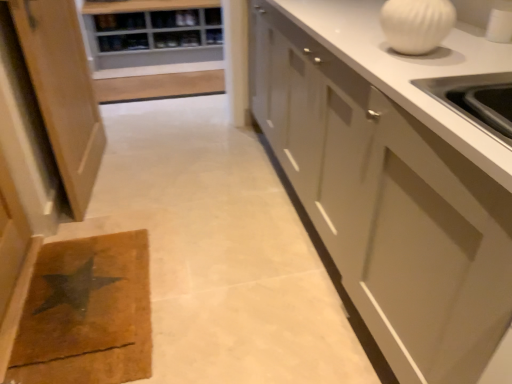
This screenshot has height=384, width=512. Describe the element at coordinates (387, 206) in the screenshot. I see `white glossy cabinet at right, which is the second cabinetry in left-to-right order` at that location.

Describe the element at coordinates (416, 24) in the screenshot. I see `white glossy vase at upper right` at that location.

Image resolution: width=512 pixels, height=384 pixels. In order to click on brown/cork doormat at lower left in this screenshot , I will do `click(87, 313)`.

Locate an element on the screen. The width and height of the screenshot is (512, 384). light brown wood cabinet at left, the second cabinetry viewed from the right is located at coordinates (63, 92).

You are a GUI agent. You are given a task and a screenshot of the screen. Output one action in this format:
    pyautogui.click(x=<x>, y=<y>)
    Task: Click on the doormat behind the white glossy vase at upper right
    The height and width of the screenshot is (384, 512).
    Given the screenshot: What is the action you would take?
    pyautogui.click(x=87, y=313)

Considering the relative positions of brown/cork doormat at lower left and white glossy vase at upper right in the image provided, is brown/cork doormat at lower left to the left or to the right of white glossy vase at upper right?

From the image, it's evident that brown/cork doormat at lower left is to the left of white glossy vase at upper right.

From the picture: Can you confirm if brown/cork doormat at lower left is smaller than white glossy vase at upper right?

No, brown/cork doormat at lower left is not smaller than white glossy vase at upper right.

Can you tell me how much white glossy vase at upper right and light brown wood cabinet at left, the second cabinetry viewed from the right, differ in facing direction?

174 degrees separate the facing orientations of white glossy vase at upper right and light brown wood cabinet at left, the second cabinetry viewed from the right.

From a real-world perspective, is white glossy vase at upper right located beneath light brown wood cabinet at left, the second cabinetry viewed from the right?

No.

Relative to light brown wood cabinet at left, the second cabinetry viewed from the right, is white glossy vase at upper right in front or behind?

Clearly, white glossy vase at upper right is in front of light brown wood cabinet at left, the second cabinetry viewed from the right.

Considering the relative sizes of white glossy vase at upper right and light brown wood cabinet at left, the second cabinetry viewed from the right, in the image provided, is white glossy vase at upper right wider than light brown wood cabinet at left, the second cabinetry viewed from the right,?

Indeed, white glossy vase at upper right has a greater width compared to light brown wood cabinet at left, the second cabinetry viewed from the right.

Does wooden shelf at upper center have a larger size compared to brown/cork doormat at lower left?

Incorrect, wooden shelf at upper center is not larger than brown/cork doormat at lower left.

Is wooden shelf at upper center located outside brown/cork doormat at lower left?

Yes, wooden shelf at upper center is not within brown/cork doormat at lower left.

Is the surface of wooden shelf at upper center in direct contact with brown/cork doormat at lower left?

wooden shelf at upper center and brown/cork doormat at lower left are not in contact.

Considering the positions of objects wooden shelf at upper center and brown/cork doormat at lower left in the image provided, who is more to the left, wooden shelf at upper center or brown/cork doormat at lower left?

From the viewer's perspective, brown/cork doormat at lower left appears more on the left side.

Does white glossy vase at upper right appear on the right side of white glossy cabinet at right, which appears as the 1th cabinetry when viewed from the right?

Incorrect, white glossy vase at upper right is not on the right side of white glossy cabinet at right, which appears as the 1th cabinetry when viewed from the right.

Is white glossy vase at upper right wider than white glossy cabinet at right, which is the second cabinetry in left-to-right order?

In fact, white glossy vase at upper right might be narrower than white glossy cabinet at right, which is the second cabinetry in left-to-right order.

Is white glossy vase at upper right positioned in front of white glossy cabinet at right, which appears as the 1th cabinetry when viewed from the right?

No, the depth of white glossy vase at upper right is greater than that of white glossy cabinet at right, which appears as the 1th cabinetry when viewed from the right.

From the picture: Could white glossy cabinet at right, which appears as the 1th cabinetry when viewed from the right, be considered to be inside white glossy vase at upper right?

Actually, white glossy cabinet at right, which appears as the 1th cabinetry when viewed from the right, is outside white glossy vase at upper right.

From the image's perspective, is white glossy cabinet at right, which appears as the 1th cabinetry when viewed from the right, on light brown wood cabinet at left, which is counted as the first cabinetry, starting from the left?

No, from the image's perspective, white glossy cabinet at right, which appears as the 1th cabinetry when viewed from the right, is not on top of light brown wood cabinet at left, which is counted as the first cabinetry, starting from the left.

Is white glossy cabinet at right, which is the second cabinetry in left-to-right order, closer to camera compared to light brown wood cabinet at left, which is counted as the first cabinetry, starting from the left?

Yes, it is.

Visually, is white glossy cabinet at right, which appears as the 1th cabinetry when viewed from the right, positioned to the left or to the right of light brown wood cabinet at left, which is counted as the first cabinetry, starting from the left?

Clearly, white glossy cabinet at right, which appears as the 1th cabinetry when viewed from the right, is on the right of light brown wood cabinet at left, which is counted as the first cabinetry, starting from the left, in the image.

Considering the relative sizes of wooden shelf at upper center and light brown wood cabinet at left, the second cabinetry viewed from the right, in the image provided, is wooden shelf at upper center wider than light brown wood cabinet at left, the second cabinetry viewed from the right,?

Yes, wooden shelf at upper center is wider than light brown wood cabinet at left, the second cabinetry viewed from the right.

Is wooden shelf at upper center in front of or behind light brown wood cabinet at left, which is counted as the first cabinetry, starting from the left, in the image?

wooden shelf at upper center is behind light brown wood cabinet at left, which is counted as the first cabinetry, starting from the left.

How many degrees apart are the facing directions of wooden shelf at upper center and light brown wood cabinet at left, the second cabinetry viewed from the right?

wooden shelf at upper center and light brown wood cabinet at left, the second cabinetry viewed from the right, are facing 81.9 degrees away from each other.

Could you tell me if wooden shelf at upper center is turned towards light brown wood cabinet at left, the second cabinetry viewed from the right?

No, wooden shelf at upper center is not facing towards light brown wood cabinet at left, the second cabinetry viewed from the right.

From a real-world perspective, who is located lower, brown/cork doormat at lower left or wooden shelf at upper center?

In real-world perspective, brown/cork doormat at lower left is lower.

Which is farther, (109, 311) or (218, 43)?

The point (218, 43) is behind.

Locate an element on the screen. shelf that appears above the brown/cork doormat at lower left (from the image's perspective) is located at coordinates (214, 36).

Where is `doormat behind the white glossy vase at upper right`? This screenshot has height=384, width=512. doormat behind the white glossy vase at upper right is located at coordinates (87, 313).

Where is `cabinetry that is on the left side of white glossy vase at upper right`? cabinetry that is on the left side of white glossy vase at upper right is located at coordinates (63, 92).

From the picture: Considering their positions, is white glossy vase at upper right positioned further to brown/cork doormat at lower left than light brown wood cabinet at left, which is counted as the first cabinetry, starting from the left?

The object further to brown/cork doormat at lower left is white glossy vase at upper right.

From the image, which object appears to be nearer to white glossy cabinet at right, which appears as the 1th cabinetry when viewed from the right, brown/cork doormat at lower left or white glossy vase at upper right?

white glossy vase at upper right.

Looking at the image, which one is located further to wooden shelf at upper center, white glossy vase at upper right or light brown wood cabinet at left, which is counted as the first cabinetry, starting from the left?

Among the two, white glossy vase at upper right is located further to wooden shelf at upper center.

When comparing their distances from white glossy vase at upper right, does light brown wood cabinet at left, which is counted as the first cabinetry, starting from the left, or brown/cork doormat at lower left seem closer?

Based on the image, brown/cork doormat at lower left appears to be nearer to white glossy vase at upper right.

Considering their positions, is white glossy vase at upper right positioned closer to white glossy cabinet at right, which is the second cabinetry in left-to-right order, than light brown wood cabinet at left, which is counted as the first cabinetry, starting from the left?

Based on the image, white glossy vase at upper right appears to be nearer to white glossy cabinet at right, which is the second cabinetry in left-to-right order.

Based on their spatial positions, is brown/cork doormat at lower left or light brown wood cabinet at left, the second cabinetry viewed from the right, closer to white glossy cabinet at right, which is the second cabinetry in left-to-right order?

brown/cork doormat at lower left lies closer to white glossy cabinet at right, which is the second cabinetry in left-to-right order, than the other object.

Which object lies further to the anchor point wooden shelf at upper center, white glossy cabinet at right, which appears as the 1th cabinetry when viewed from the right, or light brown wood cabinet at left, the second cabinetry viewed from the right?

white glossy cabinet at right, which appears as the 1th cabinetry when viewed from the right, is further to wooden shelf at upper center.

From the picture: When comparing their distances from white glossy vase at upper right, does wooden shelf at upper center or light brown wood cabinet at left, which is counted as the first cabinetry, starting from the left, seem further?

wooden shelf at upper center lies further to white glossy vase at upper right than the other object.

What are the coordinates of `doormat between white glossy cabinet at right, which is the second cabinetry in left-to-right order, and wooden shelf at upper center from front to back` in the screenshot? It's located at (87, 313).

Locate an element on the screen. This screenshot has height=384, width=512. doormat situated between light brown wood cabinet at left, the second cabinetry viewed from the right, and white glossy cabinet at right, which is the second cabinetry in left-to-right order, from left to right is located at coordinates (87, 313).

At what (x,y) coordinates should I click in order to perform the action: click on doormat between white glossy vase at upper right and wooden shelf at upper center in the front-back direction. Please return your answer as a coordinate pair (x, y). This screenshot has width=512, height=384. Looking at the image, I should click on (87, 313).

The width and height of the screenshot is (512, 384). I want to click on cabinetry between white glossy vase at upper right and wooden shelf at upper center along the z-axis, so click(63, 92).